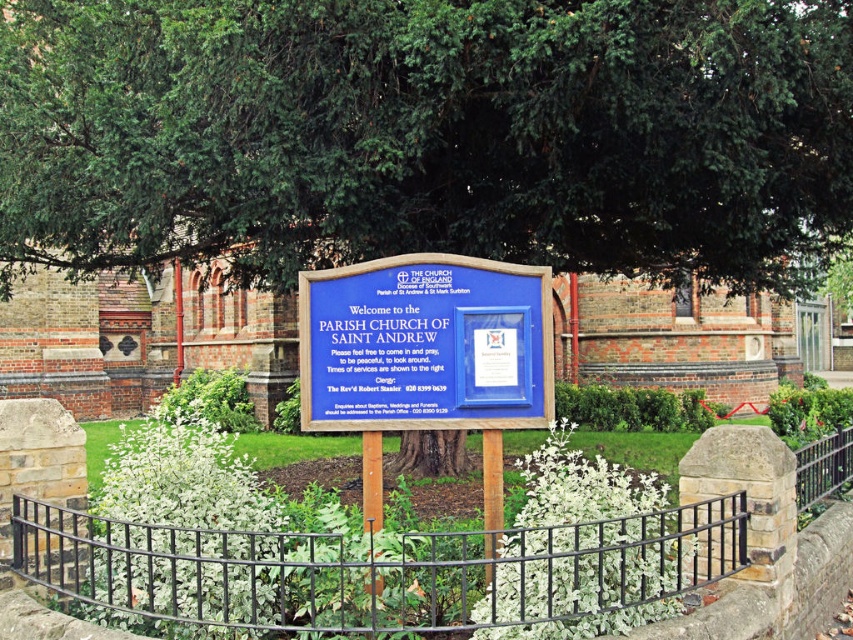
Describe the element at coordinates (379, 570) in the screenshot. Image resolution: width=853 pixels, height=640 pixels. I see `black metal fence at center` at that location.

Does black metal fence at center have a greater width compared to blue wooden sign at center?

Indeed, black metal fence at center has a greater width compared to blue wooden sign at center.

The width and height of the screenshot is (853, 640). What do you see at coordinates (379, 570) in the screenshot?
I see `black metal fence at center` at bounding box center [379, 570].

The image size is (853, 640). Identify the location of black metal fence at center. (379, 570).

Does green leafy tree at upper center have a smaller size compared to blue wooden sign at center?

Indeed, green leafy tree at upper center has a smaller size compared to blue wooden sign at center.

Which is more to the right, green leafy tree at upper center or blue wooden sign at center?

From the viewer's perspective, green leafy tree at upper center appears more on the right side.

Is point (821, 61) more distant than point (360, 404)?

Yes, it is behind point (360, 404).

The width and height of the screenshot is (853, 640). What are the coordinates of `green leafy tree at upper center` in the screenshot? It's located at (428, 134).

Between green leafy tree at upper center and black metal fence at center, which one appears on the left side from the viewer's perspective?

Positioned to the left is black metal fence at center.

Between green leafy tree at upper center and black metal fence at center, which one has more height?

Standing taller between the two is black metal fence at center.

Is point (367, 49) positioned after point (521, 570)?

Yes.

Locate an element on the screen. The height and width of the screenshot is (640, 853). green leafy tree at upper center is located at coordinates (428, 134).